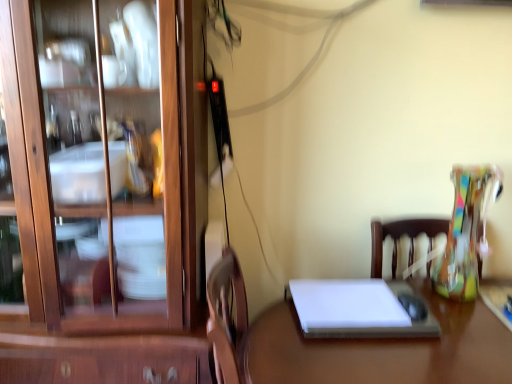
Question: Is white matte notebook at center to the left of white glossy desk at center from the viewer's perspective?

Choices:
 (A) no
 (B) yes

Answer: (A)

Question: Can you confirm if white matte notebook at center is shorter than white glossy desk at center?

Choices:
 (A) no
 (B) yes

Answer: (B)

Question: Is white matte notebook at center outside white glossy desk at center?

Choices:
 (A) no
 (B) yes

Answer: (A)

Question: Would you say white matte notebook at center is a long distance from white glossy desk at center?

Choices:
 (A) yes
 (B) no

Answer: (B)

Question: From a real-world perspective, is white matte notebook at center located beneath white glossy desk at center?

Choices:
 (A) no
 (B) yes

Answer: (A)

Question: Is white matte notebook at center wider than white glossy desk at center?

Choices:
 (A) no
 (B) yes

Answer: (A)

Question: Can you confirm if white glossy desk at center is wider than white matte notebook at center?

Choices:
 (A) no
 (B) yes

Answer: (B)

Question: Is the position of white glossy desk at center less distant than that of white matte notebook at center?

Choices:
 (A) yes
 (B) no

Answer: (A)

Question: Is white glossy desk at center not inside white matte notebook at center?

Choices:
 (A) yes
 (B) no

Answer: (A)

Question: Does white glossy desk at center have a lesser width compared to white matte notebook at center?

Choices:
 (A) yes
 (B) no

Answer: (B)

Question: Are white glossy desk at center and white matte notebook at center beside each other?

Choices:
 (A) yes
 (B) no

Answer: (B)

Question: Are white glossy desk at center and white matte notebook at center far apart?

Choices:
 (A) yes
 (B) no

Answer: (B)

Question: Would you say wooden cabinet at left is a long distance from white glossy desk at center?

Choices:
 (A) yes
 (B) no

Answer: (B)